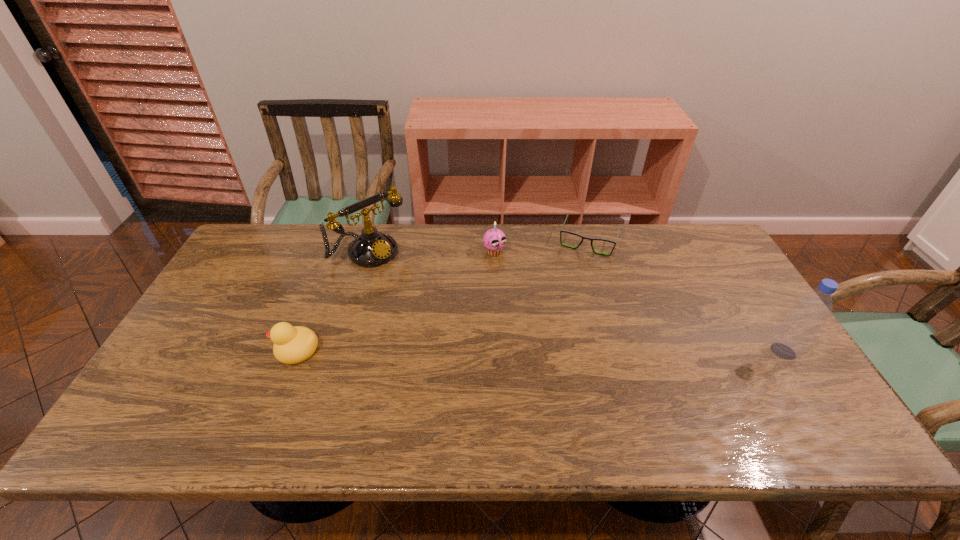
The width and height of the screenshot is (960, 540). What are the coordinates of `free space located on the back of the rightmost object` in the screenshot? It's located at (739, 282).

The height and width of the screenshot is (540, 960). I want to click on free location located 0.100m on the face of the third shortest object, so click(516, 276).

Where is `vacant area situated 0.350m on the face of the third shortest object`? The image size is (960, 540). vacant area situated 0.350m on the face of the third shortest object is located at coordinates (566, 329).

Identify the location of vacant region located on the face of the third shortest object. The image size is (960, 540). [x=538, y=298].

Locate an element on the screen. The width and height of the screenshot is (960, 540). free space located 0.250m on the dial of the fourth shortest object is located at coordinates (441, 309).

Where is `vacant space situated on the dial of the fourth shortest object`? The height and width of the screenshot is (540, 960). vacant space situated on the dial of the fourth shortest object is located at coordinates (418, 290).

The height and width of the screenshot is (540, 960). In order to click on free spot located on the dial of the fourth shortest object in this screenshot , I will do `click(428, 299)`.

Locate an element on the screen. The image size is (960, 540). vacant position located 0.360m on the lens of the shortest object is located at coordinates (554, 335).

Where is `free region located 0.260m on the lens of the shortest object`? This screenshot has width=960, height=540. free region located 0.260m on the lens of the shortest object is located at coordinates (563, 310).

What are the coordinates of `vacant point located on the lens of the shortest object` in the screenshot? It's located at (x=567, y=296).